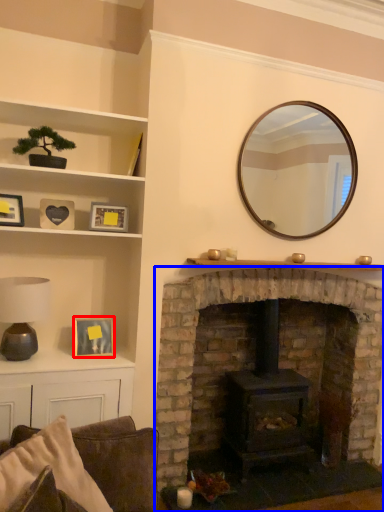
Question: Which point is closer to the camera, picture frame (highlighted by a red box) or fireplace (highlighted by a blue box)?

Choices:
 (A) picture frame
 (B) fireplace

Answer: (B)